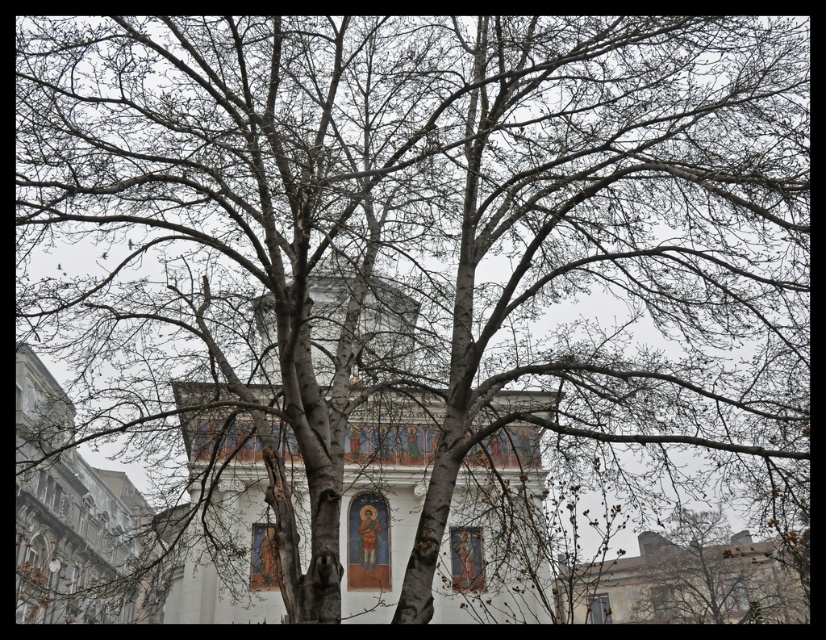
Does white painted wood church at center appear on the left side of white stone church at lower right?

Indeed, white painted wood church at center is positioned on the left side of white stone church at lower right.

Describe the element at coordinates (385, 483) in the screenshot. The width and height of the screenshot is (826, 640). I see `white painted wood church at center` at that location.

You are a GUI agent. You are given a task and a screenshot of the screen. Output one action in this format:
    pyautogui.click(x=<x>, y=<y>)
    Task: Click on the white painted wood church at center
    
    Given the screenshot: What is the action you would take?
    pyautogui.click(x=385, y=483)

Can you confirm if white stone church at left is positioned to the right of white stone church at lower right?

Incorrect, white stone church at left is not on the right side of white stone church at lower right.

Who is lower down, white stone church at left or white stone church at lower right?

Positioned lower is white stone church at lower right.

Between point (44, 380) and point (675, 580), which one is positioned behind?

The point (44, 380) is behind.

Find the location of a particular element. white stone church at left is located at coordinates (70, 516).

Is white painted wood church at center smaller than white stone church at left?

Incorrect, white painted wood church at center is not smaller in size than white stone church at left.

Is white painted wood church at center taller than white stone church at left?

Incorrect, white painted wood church at center's height is not larger of white stone church at left's.

Does point (454, 577) lie behind point (34, 547)?

That is False.

At what (x,y) coordinates should I click in order to perform the action: click on white painted wood church at center. Please return your answer as a coordinate pair (x, y). The width and height of the screenshot is (826, 640). Looking at the image, I should click on (385, 483).